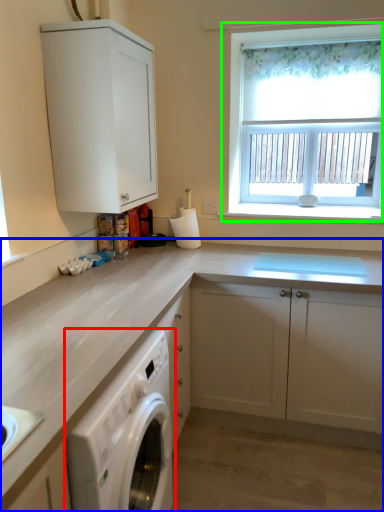
Question: Which object is the farthest from home appliance (highlighted by a red box)? Choose among these: cabinetry (highlighted by a blue box) or window (highlighted by a green box).

Choices:
 (A) cabinetry
 (B) window

Answer: (B)